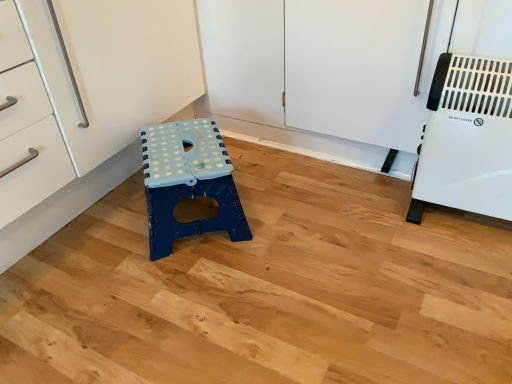
Identify the location of free space to the left of blue plastic stool at center. (93, 239).